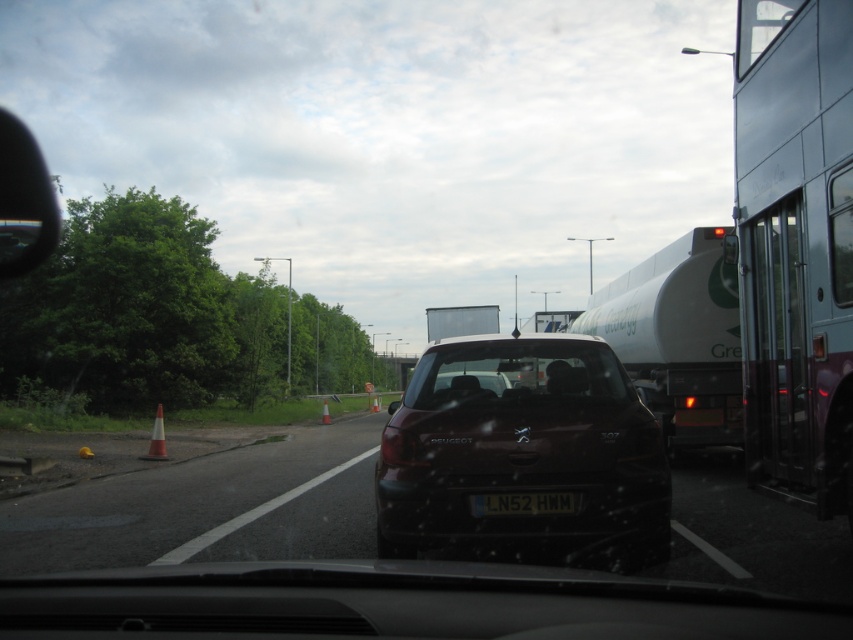
Question: Which point is closer to the camera taking this photo?

Choices:
 (A) (161, 428)
 (B) (729, 321)
 (C) (373, 410)
 (D) (438, 372)

Answer: (D)

Question: Considering the real-world distances, which object is closest to the transparent glass windshield at center?

Choices:
 (A) orange cone at center
 (B) orange traffic cone at center
 (C) satin black car at center

Answer: (C)

Question: Observing the image, what is the correct spatial positioning of white glossy trailer truck at center in reference to orange traffic cone at center?

Choices:
 (A) right
 (B) left

Answer: (A)

Question: Which of the following is the farthest from the observer?

Choices:
 (A) metallic silver bus at right
 (B) satin black car at center
 (C) orange traffic cone at center
 (D) orange reflective cone at lower left

Answer: (C)

Question: Does white glossy trailer truck at center have a lesser width compared to orange traffic cone at center?

Choices:
 (A) yes
 (B) no

Answer: (B)

Question: Does orange reflective cone at lower left appear on the left side of orange traffic cone at center?

Choices:
 (A) yes
 (B) no

Answer: (A)